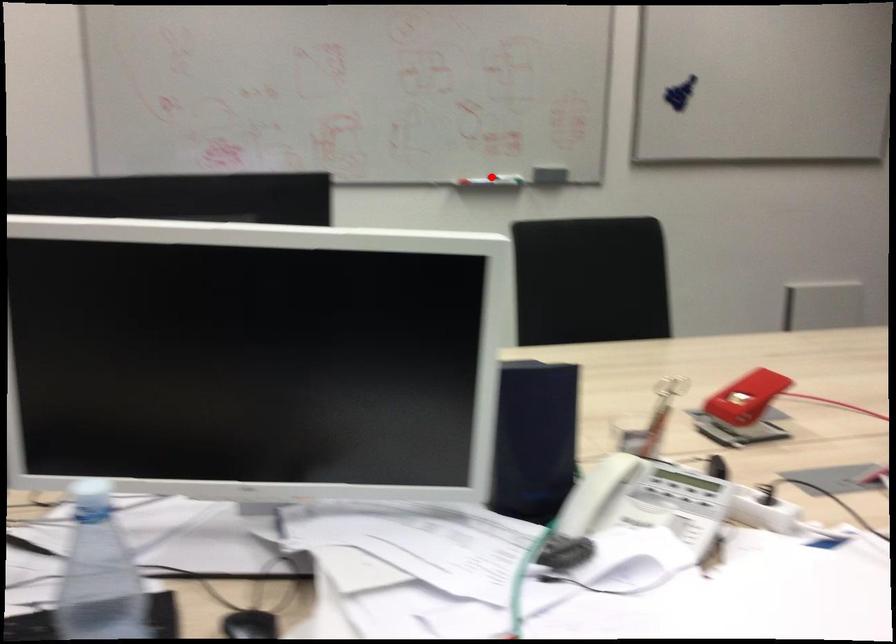
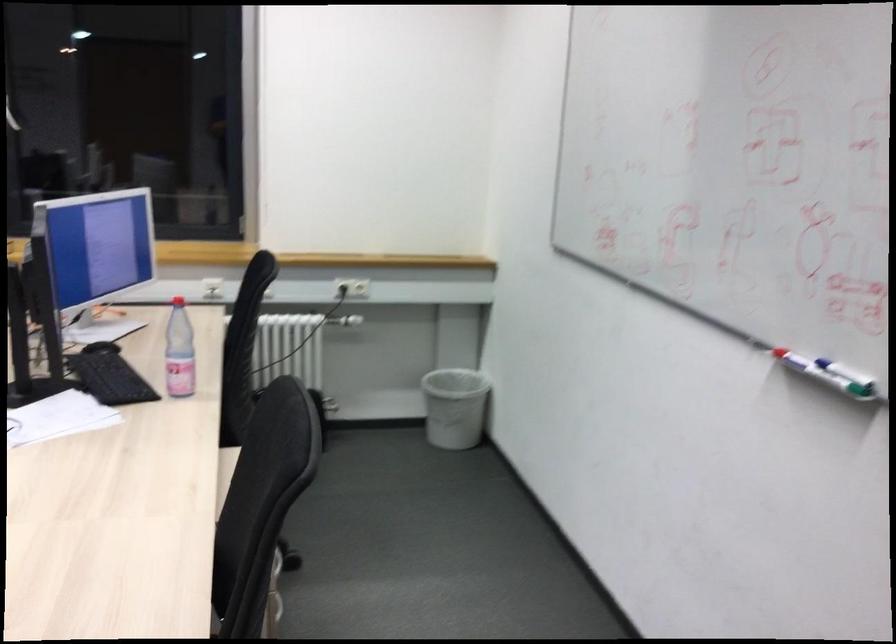
Where in the second image is the point corresponding to the highlighted location from the first image?

(829, 374)